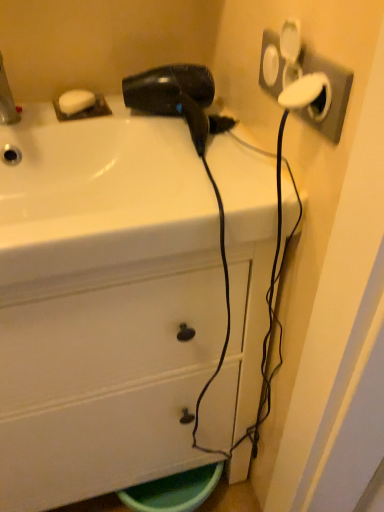
Question: Is white plastic socket at upper right wider than white matte soap at upper left?

Choices:
 (A) yes
 (B) no

Answer: (B)

Question: Considering the relative positions of white plastic socket at upper right and white matte soap at upper left in the image provided, is white plastic socket at upper right to the left of white matte soap at upper left from the viewer's perspective?

Choices:
 (A) no
 (B) yes

Answer: (A)

Question: Is white plastic socket at upper right positioned with its back to white matte soap at upper left?

Choices:
 (A) yes
 (B) no

Answer: (B)

Question: Could you tell me if white plastic socket at upper right is facing white matte soap at upper left?

Choices:
 (A) no
 (B) yes

Answer: (A)

Question: Is white plastic socket at upper right not near white matte soap at upper left?

Choices:
 (A) yes
 (B) no

Answer: (B)

Question: Which is correct: brushed metal faucet at upper left is inside white plastic socket at upper right, or outside of it?

Choices:
 (A) outside
 (B) inside

Answer: (A)

Question: Considering their positions, is brushed metal faucet at upper left located in front of or behind white plastic socket at upper right?

Choices:
 (A) front
 (B) behind

Answer: (B)

Question: Is brushed metal faucet at upper left bigger or smaller than white plastic socket at upper right?

Choices:
 (A) small
 (B) big

Answer: (B)

Question: From a real-world perspective, is brushed metal faucet at upper left positioned above or below white plastic socket at upper right?

Choices:
 (A) above
 (B) below

Answer: (B)

Question: Is black matte hair dryer at upper center bigger or smaller than white matte soap at upper left?

Choices:
 (A) small
 (B) big

Answer: (B)

Question: From a real-world perspective, relative to white matte soap at upper left, is black matte hair dryer at upper center vertically above or below?

Choices:
 (A) above
 (B) below

Answer: (A)

Question: In the image, is black matte hair dryer at upper center on the left side or the right side of white matte soap at upper left?

Choices:
 (A) left
 (B) right

Answer: (B)

Question: Is black matte hair dryer at upper center wider or thinner than white matte soap at upper left?

Choices:
 (A) wide
 (B) thin

Answer: (A)

Question: Relative to white matte soap at upper left, is white glossy cabinet at center in front or behind?

Choices:
 (A) behind
 (B) front

Answer: (B)

Question: Is white glossy cabinet at center taller or shorter than white matte soap at upper left?

Choices:
 (A) short
 (B) tall

Answer: (B)